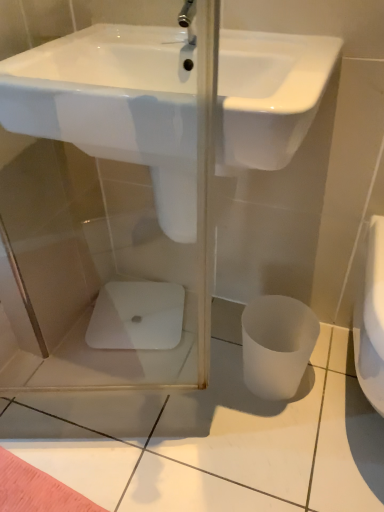
Question: Is point (144, 158) positioned closer to the camera than point (92, 312)?

Choices:
 (A) closer
 (B) farther

Answer: (A)

Question: From a real-world perspective, is white glossy sink at upper center positioned above or below white glossy porcelain at center?

Choices:
 (A) above
 (B) below

Answer: (A)

Question: Which of these objects is positioned farthest from the white glossy sink at upper center?

Choices:
 (A) white glossy porcelain at center
 (B) white matte toilet bowl at lower right

Answer: (A)

Question: Considering the real-world distances, which object is closest to the white matte toilet bowl at lower right?

Choices:
 (A) white glossy porcelain at center
 (B) white glossy sink at upper center

Answer: (A)